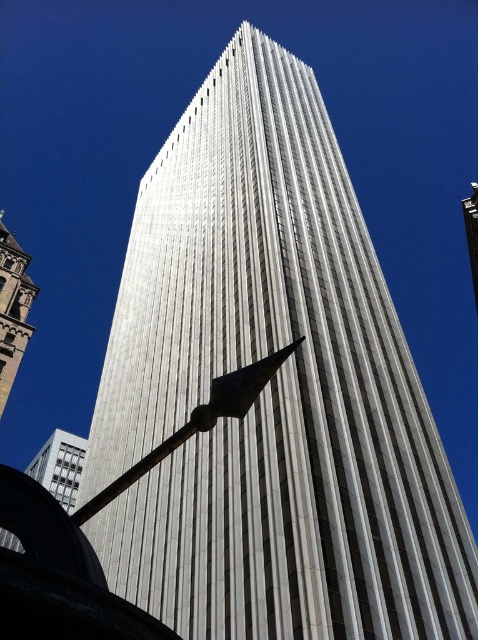
Looking at this image, you are an architect evaluating the structural integrity of the scene. Given that the metallic polished pole at center supports the white marble tower at left, is there a risk of the tower collapsing?

The metallic polished pole at center is positioned under the white marble tower at left, which means it is directly supporting the tower. Since the pole is metallic and polished, it may be strong enough to bear the weight, but without knowing the pole diameter or material strength, it is impossible to confirm the risk of collapse. However, based on the description, the pole is positioned under the tower, so it is likely designed to support it safely.

You are a city planner who wants to install a new bench between the metallic polished pole at center and the white marble tower at left. The bench is 3 meters long. Can you place it directly between them without moving either object?

The metallic polished pole at center is 28.04 meters from the white marble tower at left. Since the bench is only 3 meters long, there is sufficient space to place it directly between them without moving either object.